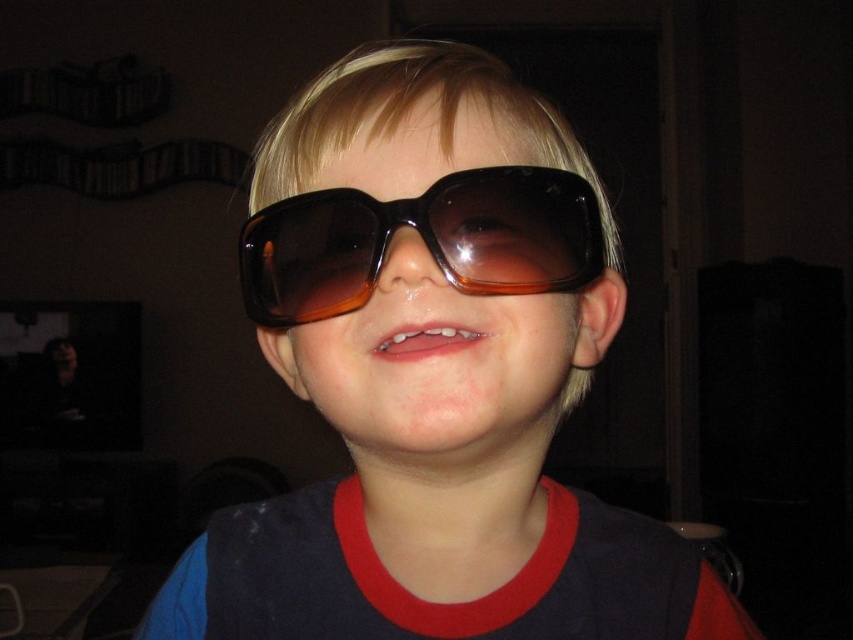
Between brown matte sunglasses at center and brown translucent plastic goggles at center, which one is positioned higher?

brown translucent plastic goggles at center is above.

Does brown matte sunglasses at center have a lesser height compared to brown translucent plastic goggles at center?

No, brown matte sunglasses at center is not shorter than brown translucent plastic goggles at center.

Between point (500, 592) and point (328, 221), which one is positioned behind?

The point (500, 592) is more distant.

Where is `brown matte sunglasses at center`? This screenshot has height=640, width=853. brown matte sunglasses at center is located at coordinates (434, 378).